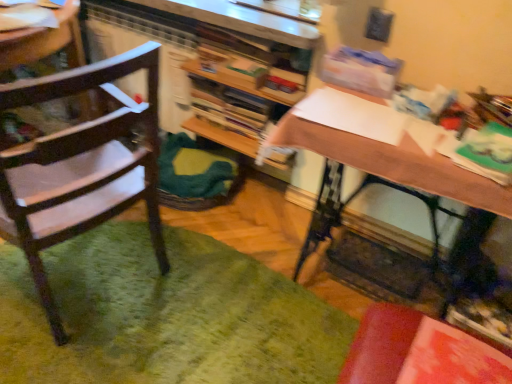
The width and height of the screenshot is (512, 384). In order to click on vacant space underneath wooden desk at center (from a real-world perspective) in this screenshot , I will do `click(377, 271)`.